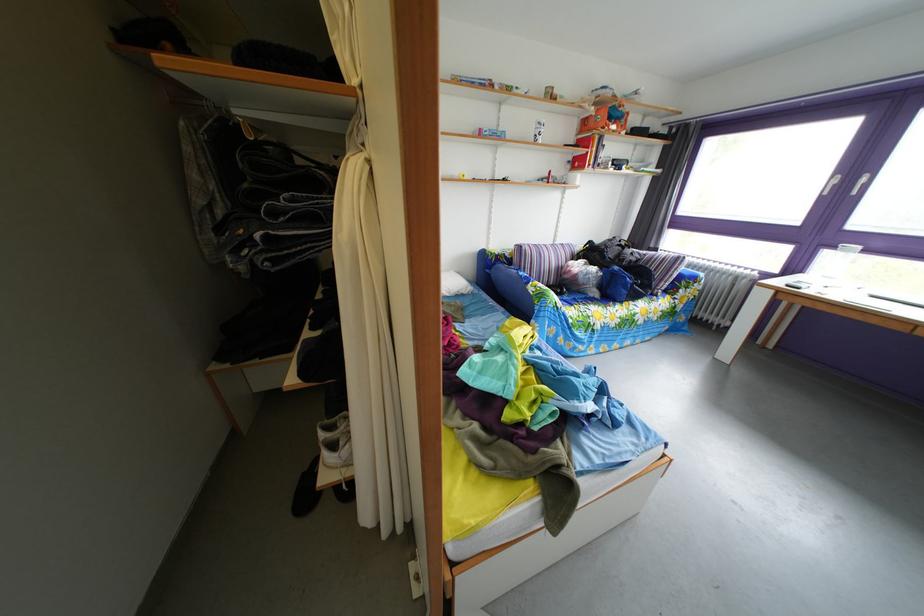
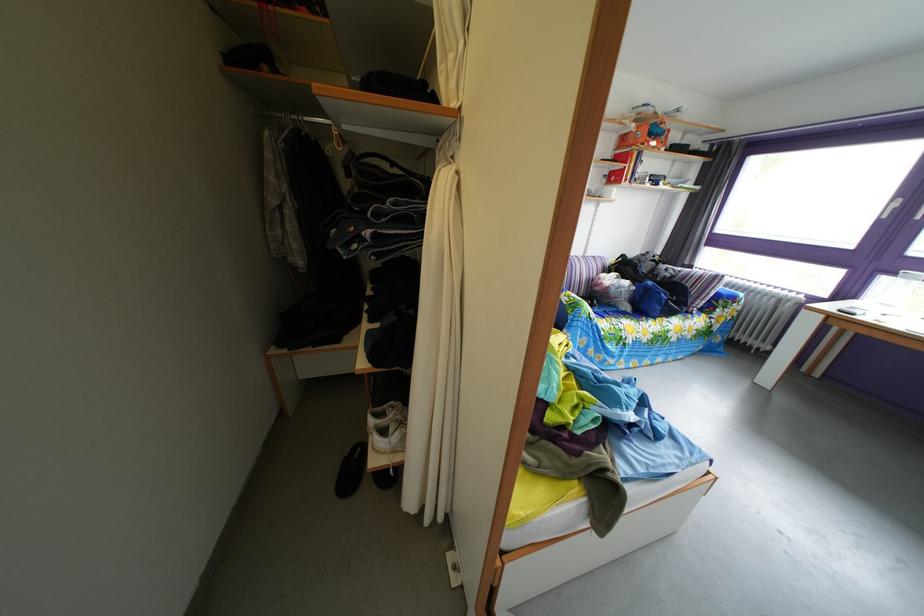
Where in the second image is the point corresponding to the point at 344,201 from the first image?

(438, 207)